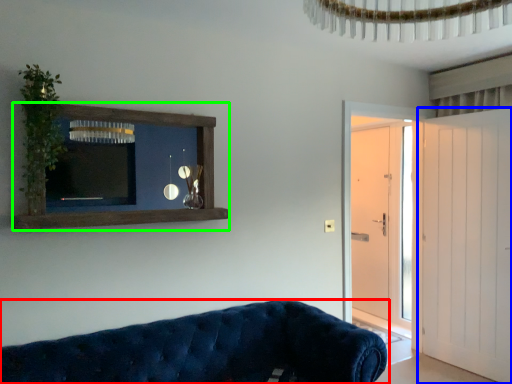
Question: Which object is the farthest from studio couch (highlighted by a red box)? Choose among these: door (highlighted by a blue box) or shelf (highlighted by a green box).

Choices:
 (A) door
 (B) shelf

Answer: (A)